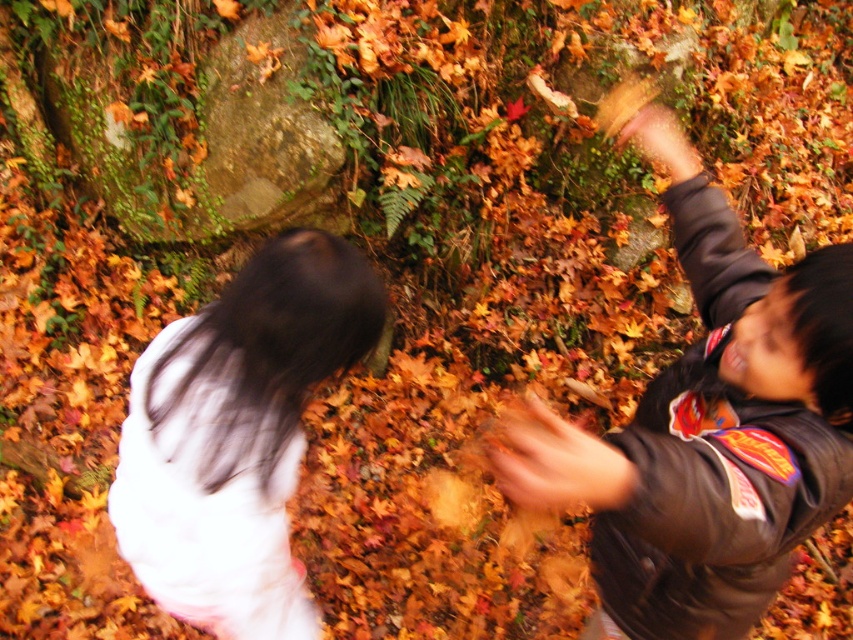
Question: Which of the following is the farthest from the observer?

Choices:
 (A) dark gray jacket at right
 (B) white matte shirt at upper left

Answer: (B)

Question: Does dark gray jacket at right appear on the left side of white matte shirt at upper left?

Choices:
 (A) yes
 (B) no

Answer: (B)

Question: Is dark gray jacket at right thinner than blurred brown hand at center?

Choices:
 (A) yes
 (B) no

Answer: (B)

Question: Which point appears farthest from the camera in this image?

Choices:
 (A) (810, 433)
 (B) (560, 477)
 (C) (239, 484)

Answer: (C)

Question: Can you confirm if dark gray jacket at right is thinner than blurred brown hand at center?

Choices:
 (A) yes
 (B) no

Answer: (B)

Question: Which point is farther to the camera?

Choices:
 (A) (679, 604)
 (B) (234, 314)

Answer: (A)